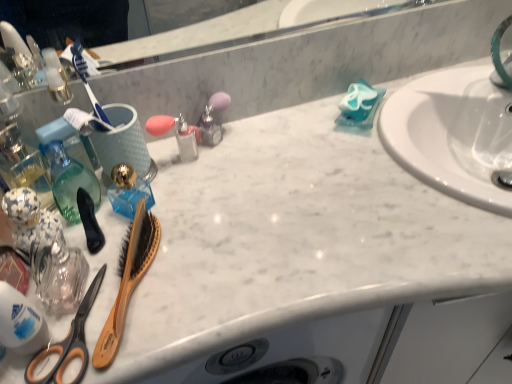
The height and width of the screenshot is (384, 512). Find the location of `free space between blue matte soap at upper right, the 1th cleaning product positioned from the top, and translucent plastic bottle at lower left, acting as the first cleaning product starting from the front`. free space between blue matte soap at upper right, the 1th cleaning product positioned from the top, and translucent plastic bottle at lower left, acting as the first cleaning product starting from the front is located at coordinates (267, 181).